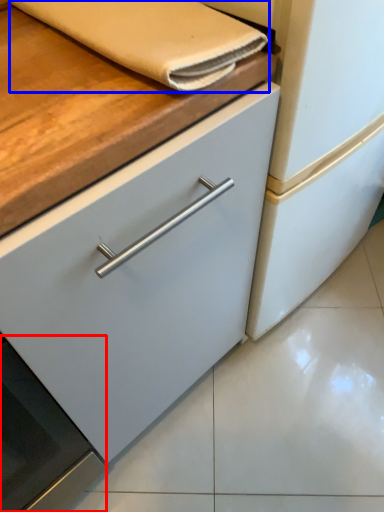
Question: Which point is closer to the camera, oven (highlighted by a red box) or hand towel (highlighted by a blue box)?

Choices:
 (A) oven
 (B) hand towel

Answer: (A)